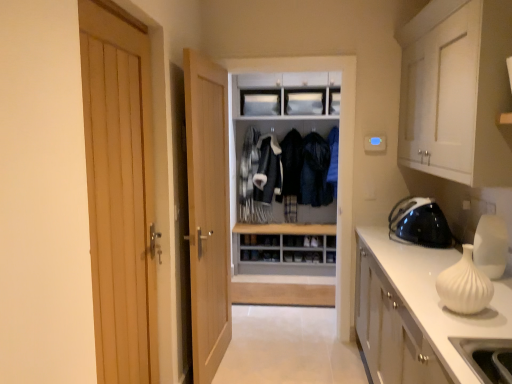
What is the approximate height of white glossy vase at right, placed as the 2th appliance when sorted from back to front?

The height of white glossy vase at right, placed as the 2th appliance when sorted from back to front, is 30.29 centimeters.

Where is `white matte vase at right`? The height and width of the screenshot is (384, 512). white matte vase at right is located at coordinates (464, 285).

Describe the element at coordinates (315, 172) in the screenshot. This screenshot has height=384, width=512. I see `dark blue leather jacket at center, marked as the first clothing in a right-to-left arrangement` at that location.

What is the approximate width of black glossy iron at right, the first appliance viewed from the back?

The width of black glossy iron at right, the first appliance viewed from the back, is 40.29 centimeters.

Identify the location of white glossy cabinet at right, the first cabinetry when ordered from bottom to top. (398, 316).

In order to face light wood door at center, which is the 1th door in back-to-front order, should I rotate leftwards or rightwards?

Rotate your view left by about 5.259°.

Locate an element on the screen. white glossy vase at right, placed as the 2th appliance when sorted from back to front is located at coordinates (490, 246).

Between dark blue fabric jacket at center, the 2th clothing from the right, and black glossy iron at right, the first appliance viewed from the back, which one is positioned in front?

black glossy iron at right, the first appliance viewed from the back, is in front.

Can you confirm if dark blue fabric jacket at center, the 2th clothing from the right, is shorter than black glossy iron at right, the 2th appliance viewed from the front?

No, dark blue fabric jacket at center, the 2th clothing from the right, is not shorter than black glossy iron at right, the 2th appliance viewed from the front.

Is gray matte dresser at center positioned far away from black glossy iron at right, the 2th appliance viewed from the front?

No.

Can you confirm if gray matte dresser at center is positioned to the right of black glossy iron at right, the 2th appliance viewed from the front?

In fact, gray matte dresser at center is to the left of black glossy iron at right, the 2th appliance viewed from the front.

How many degrees apart are the facing directions of gray matte dresser at center and black glossy iron at right, the first appliance viewed from the back?

gray matte dresser at center and black glossy iron at right, the first appliance viewed from the back, are facing 90.9 degrees away from each other.

Is black glossy iron at right, the 2th appliance viewed from the front, a part of gray matte dresser at center?

No.

Is wooden door at left, marked as the first door in a front-to-back arrangement, with white matte cabinet at upper right, which is counted as the 1th cabinetry, starting from the top?

No, wooden door at left, marked as the first door in a front-to-back arrangement, is not touching white matte cabinet at upper right, which is counted as the 1th cabinetry, starting from the top.

Does point (102, 370) come closer to viewer compared to point (490, 144)?

Yes.

Is wooden door at left, which ranks as the second door in back-to-front order, situated inside white matte cabinet at upper right, the second cabinetry from the bottom, or outside?

wooden door at left, which ranks as the second door in back-to-front order, is outside white matte cabinet at upper right, the second cabinetry from the bottom.

From the image's perspective, between wooden door at left, which appears as the 1th door when viewed from the left, and white matte cabinet at upper right, the second cabinetry from the bottom, which one is located above?

From the image's view, white matte cabinet at upper right, the second cabinetry from the bottom, is above.

Could you tell me if white matte cabinet at upper right, the second cabinetry from the bottom, is turned towards gray matte dresser at center?

No.

From a real-world perspective, is white matte cabinet at upper right, which is counted as the 1th cabinetry, starting from the top, below gray matte dresser at center?

No, from a real-world perspective, white matte cabinet at upper right, which is counted as the 1th cabinetry, starting from the top, is not under gray matte dresser at center.

From their relative heights in the image, would you say white matte cabinet at upper right, which is counted as the 1th cabinetry, starting from the top, is taller or shorter than gray matte dresser at center?

In the image, white matte cabinet at upper right, which is counted as the 1th cabinetry, starting from the top, appears to be shorter than gray matte dresser at center.

Where is `the 2nd cabinetry to the right of the gray matte dresser at center, starting your count from the anchor`? The height and width of the screenshot is (384, 512). the 2nd cabinetry to the right of the gray matte dresser at center, starting your count from the anchor is located at coordinates (457, 92).

Could dark blue fabric jacket at center, the 2th clothing from the right, be considered to be inside wooden door at left, which appears as the 1th door when viewed from the left?

No, dark blue fabric jacket at center, the 2th clothing from the right, is located outside of wooden door at left, which appears as the 1th door when viewed from the left.

From the image's perspective, is wooden door at left, which appears as the 1th door when viewed from the left, above or below dark blue fabric jacket at center, the 2th clothing from the right?

wooden door at left, which appears as the 1th door when viewed from the left, is situated lower than dark blue fabric jacket at center, the 2th clothing from the right, in the image.

In the image, is wooden door at left, marked as the first door in a front-to-back arrangement, positioned in front of or behind dark blue fabric jacket at center, which is the 1th clothing in left-to-right order?

In the image, wooden door at left, marked as the first door in a front-to-back arrangement, appears in front of dark blue fabric jacket at center, which is the 1th clothing in left-to-right order.

Is wooden door at left, marked as the first door in a front-to-back arrangement, far away from dark blue fabric jacket at center, the 2th clothing from the right?

Indeed, wooden door at left, marked as the first door in a front-to-back arrangement, is not near dark blue fabric jacket at center, the 2th clothing from the right.

Looking at this image, what's the angular difference between white glossy cabinet at right, the first cabinetry when ordered from bottom to top, and wooden door at left, marked as the first door in a front-to-back arrangement,'s facing directions?

The facing directions of white glossy cabinet at right, the first cabinetry when ordered from bottom to top, and wooden door at left, marked as the first door in a front-to-back arrangement, are 179 degrees apart.

Does white glossy cabinet at right, marked as the 2th cabinetry in a top-to-bottom arrangement, have a lesser height compared to wooden door at left, which appears as the 1th door when viewed from the left?

Yes, white glossy cabinet at right, marked as the 2th cabinetry in a top-to-bottom arrangement, is shorter than wooden door at left, which appears as the 1th door when viewed from the left.

Would you say white glossy cabinet at right, marked as the 2th cabinetry in a top-to-bottom arrangement, is outside wooden door at left, which ranks as the second door in back-to-front order?

Indeed, white glossy cabinet at right, marked as the 2th cabinetry in a top-to-bottom arrangement, is completely outside wooden door at left, which ranks as the second door in back-to-front order.

Considering the relative positions of white glossy cabinet at right, the first cabinetry when ordered from bottom to top, and wooden door at left, which appears as the 1th door when viewed from the left, in the image provided, is white glossy cabinet at right, the first cabinetry when ordered from bottom to top, behind wooden door at left, which appears as the 1th door when viewed from the left,?

No, white glossy cabinet at right, the first cabinetry when ordered from bottom to top, is closer to the viewer.

Which of these two, wooden door at left, the second door from the right, or white glossy cabinet at right, marked as the 2th cabinetry in a top-to-bottom arrangement, is bigger?

white glossy cabinet at right, marked as the 2th cabinetry in a top-to-bottom arrangement.

Considering the sizes of objects wooden door at left, which ranks as the second door in back-to-front order, and white glossy cabinet at right, the first cabinetry when ordered from bottom to top, in the image provided, who is thinner, wooden door at left, which ranks as the second door in back-to-front order, or white glossy cabinet at right, the first cabinetry when ordered from bottom to top,?

With smaller width is wooden door at left, which ranks as the second door in back-to-front order.

From a real-world perspective, is wooden door at left, which ranks as the second door in back-to-front order, physically located above or below white glossy cabinet at right, marked as the 2th cabinetry in a top-to-bottom arrangement?

In terms of real-world spatial position, wooden door at left, which ranks as the second door in back-to-front order, is above white glossy cabinet at right, marked as the 2th cabinetry in a top-to-bottom arrangement.

Is wooden door at left, which appears as the 1th door when viewed from the left, not inside white glossy cabinet at right, marked as the 2th cabinetry in a top-to-bottom arrangement?

Yes, wooden door at left, which appears as the 1th door when viewed from the left, is not within white glossy cabinet at right, marked as the 2th cabinetry in a top-to-bottom arrangement.

From the image's perspective, which clothing is the 1st one above the black glossy iron at right, the first appliance viewed from the back? Please provide its 2D coordinates.

[(291, 174)]

The width and height of the screenshot is (512, 384). What are the coordinates of `dresser on the left of black glossy iron at right, the first appliance viewed from the back` in the screenshot? It's located at (340, 183).

Looking at this image, considering their positions, is gray matte dresser at center positioned closer to white matte vase at right than wooden door at left, which ranks as the second door in back-to-front order?

gray matte dresser at center.

Based on their spatial positions, is dark blue leather jacket at center, marked as the 2th clothing in a left-to-right arrangement, or white glossy cabinet at right, the first cabinetry when ordered from bottom to top, closer to light wood door at center, marked as the second door in a front-to-back arrangement?

white glossy cabinet at right, the first cabinetry when ordered from bottom to top.

Considering their positions, is black glossy iron at right, the 2th appliance viewed from the front, positioned further to white glossy vase at right, acting as the first appliance starting from the front, than white matte vase at right?

The object further to white glossy vase at right, acting as the first appliance starting from the front, is black glossy iron at right, the 2th appliance viewed from the front.

Looking at the image, which one is located closer to white matte vase at right, white glossy cabinet at right, the first cabinetry when ordered from bottom to top, or white matte cabinet at upper right, the second cabinetry from the bottom?

Based on the image, white glossy cabinet at right, the first cabinetry when ordered from bottom to top, appears to be nearer to white matte vase at right.

Estimate the real-world distances between objects in this image. Which object is closer to white matte vase at right, white matte cabinet at upper right, the second cabinetry from the bottom, or white glossy vase at right, placed as the 2th appliance when sorted from back to front?

Among the two, white glossy vase at right, placed as the 2th appliance when sorted from back to front, is located nearer to white matte vase at right.

Estimate the real-world distances between objects in this image. Which object is further from black glossy iron at right, the 2th appliance viewed from the front, dark blue leather jacket at center, marked as the first clothing in a right-to-left arrangement, or gray matte dresser at center?

Among the two, dark blue leather jacket at center, marked as the first clothing in a right-to-left arrangement, is located further to black glossy iron at right, the 2th appliance viewed from the front.

When comparing their distances from white matte cabinet at upper right, which is counted as the 1th cabinetry, starting from the top, does black glossy iron at right, the first appliance viewed from the back, or dark blue leather jacket at center, marked as the first clothing in a right-to-left arrangement, seem further?

dark blue leather jacket at center, marked as the first clothing in a right-to-left arrangement.

Estimate the real-world distances between objects in this image. Which object is further from white glossy cabinet at right, the first cabinetry when ordered from bottom to top, wooden door at left, marked as the first door in a front-to-back arrangement, or white matte vase at right?

Based on the image, wooden door at left, marked as the first door in a front-to-back arrangement, appears to be further to white glossy cabinet at right, the first cabinetry when ordered from bottom to top.

This screenshot has height=384, width=512. What are the coordinates of `vase situated between wooden door at left, marked as the first door in a front-to-back arrangement, and white glossy cabinet at right, the first cabinetry when ordered from bottom to top, from left to right` in the screenshot? It's located at (464, 285).

Where is `dresser between white matte cabinet at upper right, the second cabinetry from the bottom, and dark blue leather jacket at center, marked as the 2th clothing in a left-to-right arrangement, from front to back`? The image size is (512, 384). dresser between white matte cabinet at upper right, the second cabinetry from the bottom, and dark blue leather jacket at center, marked as the 2th clothing in a left-to-right arrangement, from front to back is located at coordinates (340, 183).

Where is `vase located between wooden door at left, which appears as the 1th door when viewed from the left, and white matte cabinet at upper right, the second cabinetry from the bottom, in the left-right direction`? vase located between wooden door at left, which appears as the 1th door when viewed from the left, and white matte cabinet at upper right, the second cabinetry from the bottom, in the left-right direction is located at coordinates tap(464, 285).

This screenshot has width=512, height=384. Identify the location of clothing between white glossy vase at right, acting as the first appliance starting from the front, and dark blue fabric jacket at center, which is the 1th clothing in left-to-right order, along the z-axis. (315, 172).